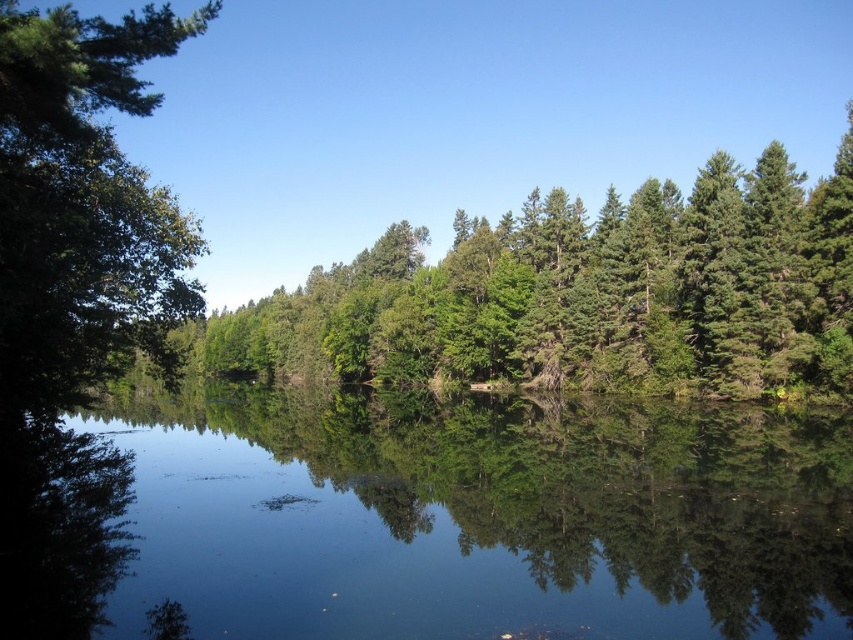
Question: Observing the image, what is the correct spatial positioning of transparent water at center in reference to green leafy tree at left?

Choices:
 (A) right
 (B) left

Answer: (A)

Question: Which object appears closest to the camera in this image?

Choices:
 (A) green leafy tree at left
 (B) transparent water at center
 (C) green leafy trees at upper center

Answer: (A)

Question: Can you confirm if transparent water at center is positioned above green leafy tree at left?

Choices:
 (A) yes
 (B) no

Answer: (B)

Question: Which object is closer to the camera taking this photo?

Choices:
 (A) transparent water at center
 (B) green leafy tree at left

Answer: (B)

Question: Is transparent water at center wider than green leafy trees at upper center?

Choices:
 (A) yes
 (B) no

Answer: (B)

Question: Which point appears closest to the camera in this image?

Choices:
 (A) (74, 38)
 (B) (682, 573)

Answer: (A)